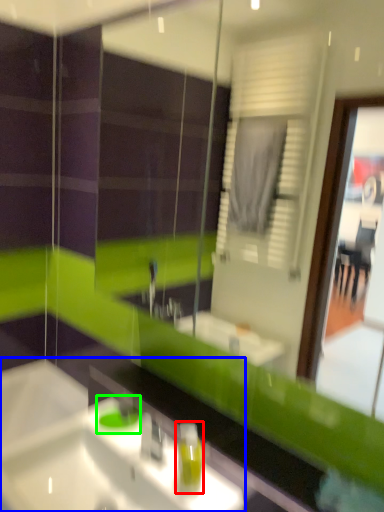
Question: Which is nearer to the soap dispenser (highlighted by a red box)? sink (highlighted by a blue box) or teal (highlighted by a green box).

Choices:
 (A) sink
 (B) teal

Answer: (A)